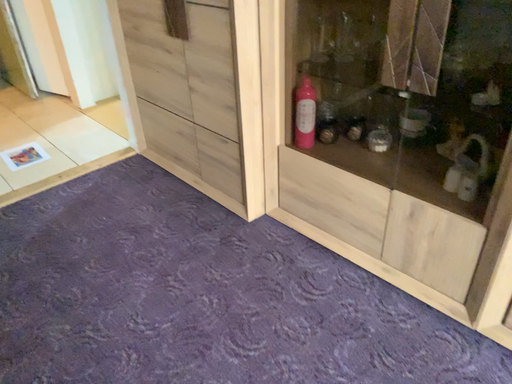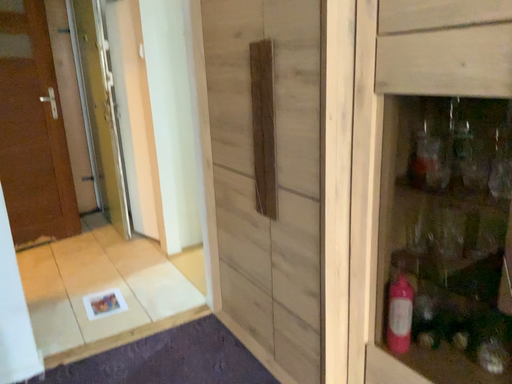
Question: How did the camera likely rotate when shooting the video?

Choices:
 (A) rotated left
 (B) rotated right

Answer: (A)